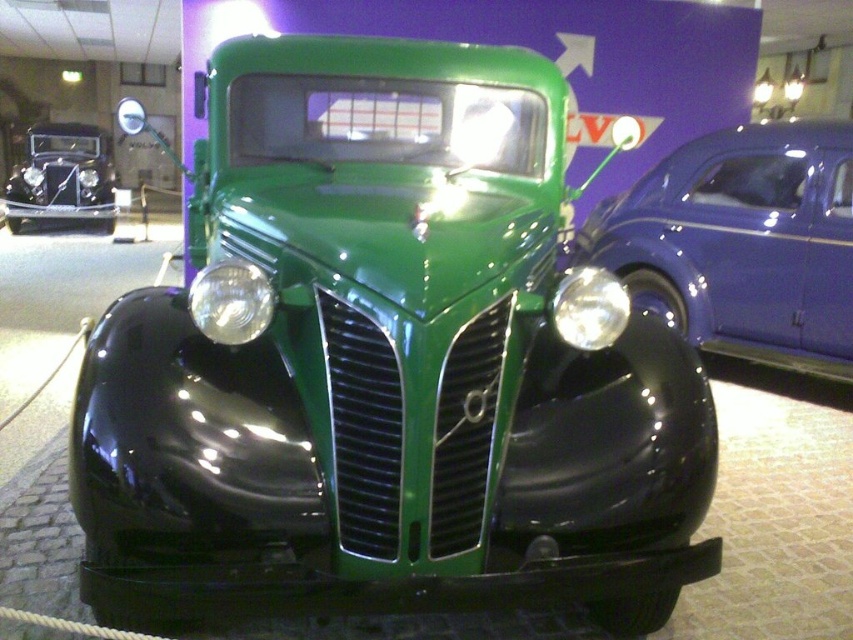
Between point (831, 145) and point (235, 317), which one is positioned behind?

Point (831, 145)

Does metallic blue car at right have a greater height compared to matte black headlight at center?

Indeed, metallic blue car at right has a greater height compared to matte black headlight at center.

Does point (642, 209) come in front of point (253, 339)?

No, it is not.

At what (x,y) coordinates should I click in order to perform the action: click on metallic blue car at right. Please return your answer as a coordinate pair (x, y). This screenshot has width=853, height=640. Looking at the image, I should click on (741, 243).

Is green shiny pickup truck at center thinner than matte black headlight at center?

Incorrect, green shiny pickup truck at center's width is not less than matte black headlight at center's.

Is point (321, 61) positioned after point (218, 339)?

Yes, it is.

You are a GUI agent. You are given a task and a screenshot of the screen. Output one action in this format:
    pyautogui.click(x=<x>, y=<y>)
    Task: Click on the green shiny pickup truck at center
    This screenshot has height=640, width=853.
    Given the screenshot: What is the action you would take?
    pos(386,365)

Locate an element on the screen. The height and width of the screenshot is (640, 853). green shiny pickup truck at center is located at coordinates (386, 365).

Between shiny black car at left and clear glass headlight at center, which one appears on the left side from the viewer's perspective?

From the viewer's perspective, shiny black car at left appears more on the left side.

Find the location of `shiny black car at left`. shiny black car at left is located at coordinates (62, 177).

Locate an element on the screen. shiny black car at left is located at coordinates (62, 177).

Find the location of a particular element. shiny black car at left is located at coordinates (62, 177).